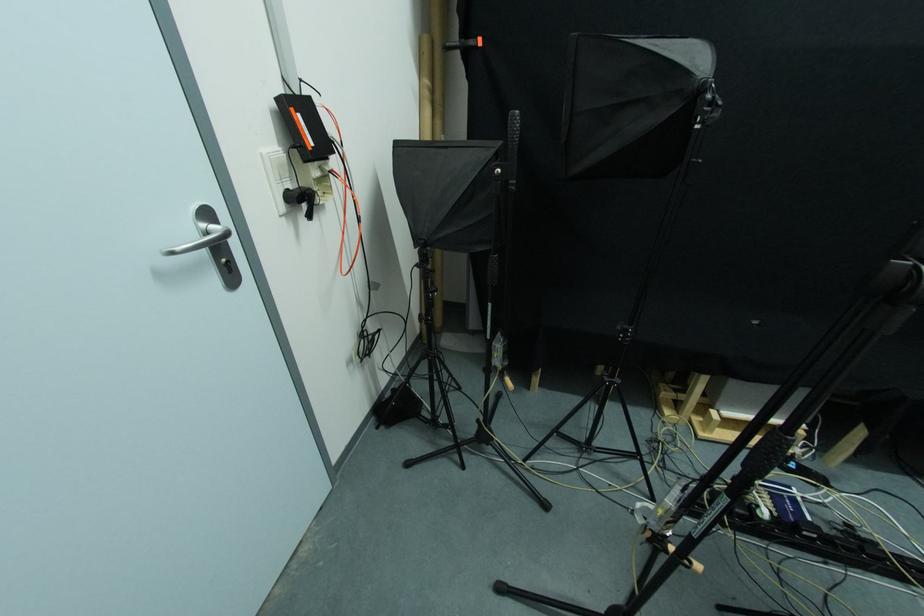
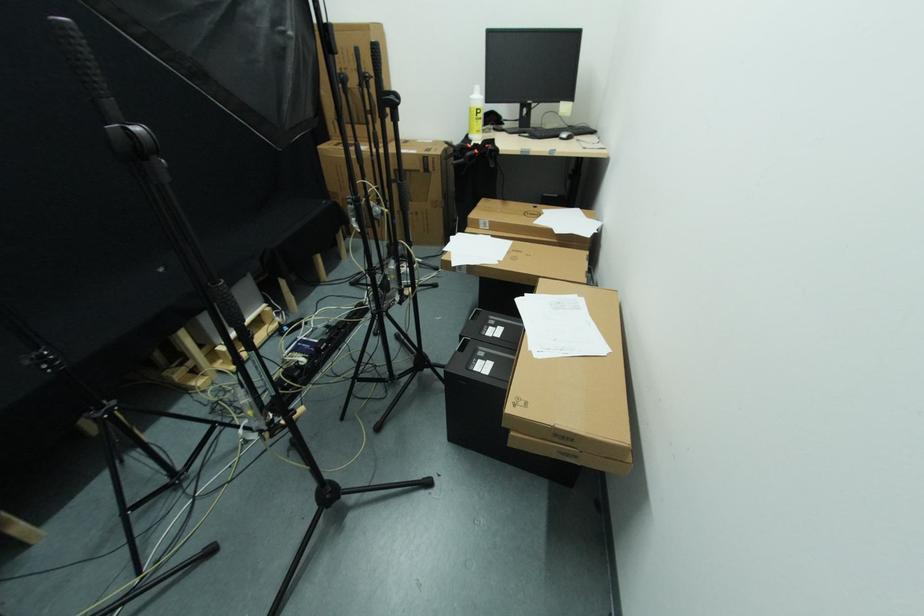
Find the pixel in the second image that matches pixel 702 424 in the first image.

(225, 365)